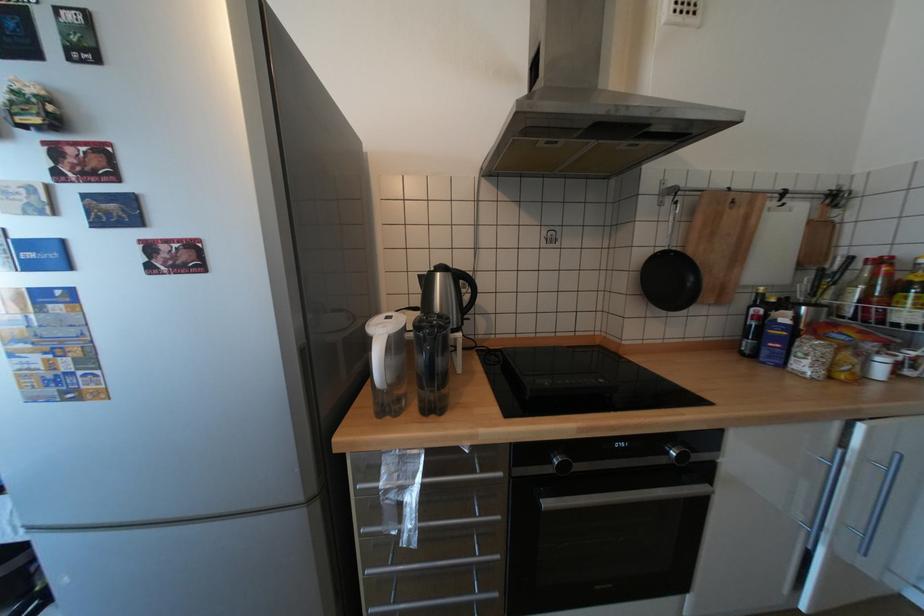
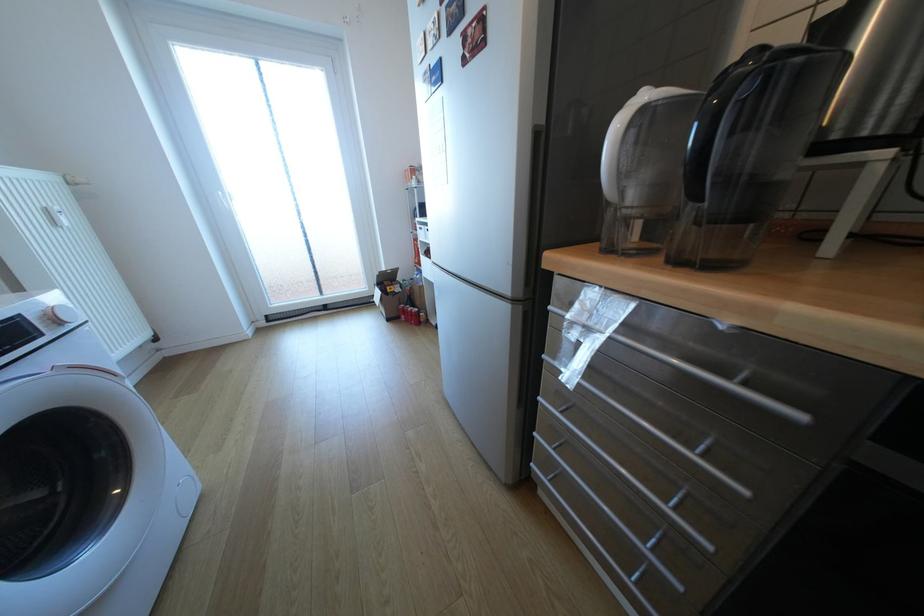
Based on the continuous images, in which direction is the camera rotating?

The rotation direction of the camera is left-down.